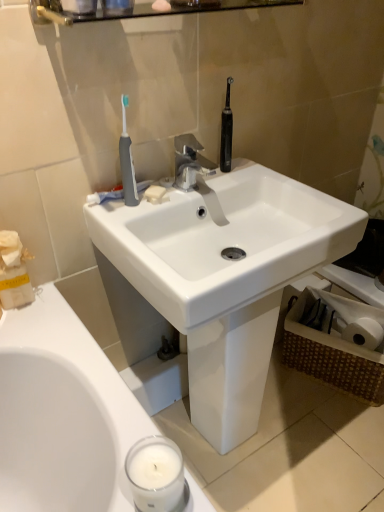
Locate an element on the screen. This screenshot has width=384, height=512. vacant space to the right of silver metallic faucet at center is located at coordinates (259, 177).